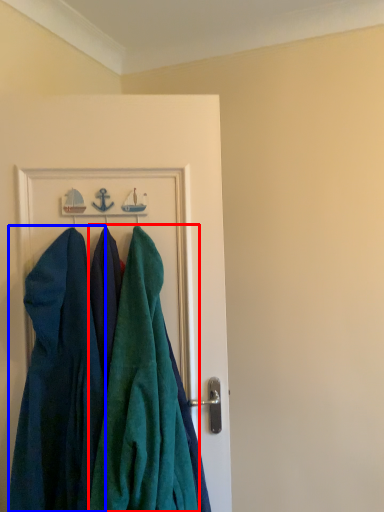
Question: Which object is closer to the camera taking this photo, towel (highlighted by a red box) or dress (highlighted by a blue box)?

Choices:
 (A) towel
 (B) dress

Answer: (A)